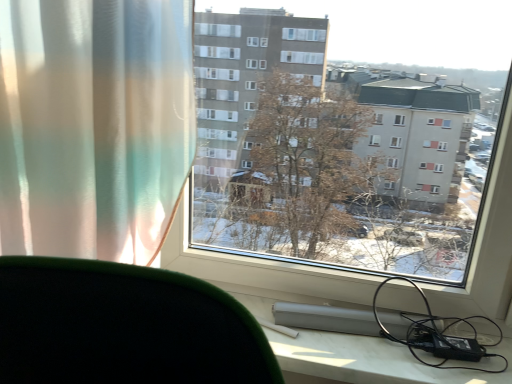
Locate an element on the screen. This screenshot has height=384, width=512. translucent fabric curtain at left is located at coordinates (94, 126).

Locate an element on the screen. Image resolution: width=512 pixels, height=384 pixels. transparent glass window at center is located at coordinates (353, 161).

Does transparent glass window at center have a lesser width compared to black rubber cable at lower right?

No, transparent glass window at center is not thinner than black rubber cable at lower right.

Can you confirm if transparent glass window at center is shorter than black rubber cable at lower right?

No.

In the scene shown: From a real-world perspective, is transparent glass window at center positioned above or below black rubber cable at lower right?

From a real-world perspective, transparent glass window at center is physically above black rubber cable at lower right.

The width and height of the screenshot is (512, 384). What are the coordinates of `window on the left of black rubber cable at lower right` in the screenshot? It's located at (353, 161).

From the picture: Looking at their sizes, would you say transparent glass window at center is wider or thinner than translucent fabric curtain at left?

Clearly, transparent glass window at center has less width compared to translucent fabric curtain at left.

I want to click on curtain lying in front of the transparent glass window at center, so click(94, 126).

How many degrees apart are the facing directions of transparent glass window at center and translucent fabric curtain at left?

The angular difference between transparent glass window at center and translucent fabric curtain at left is 0.593 degrees.

Is black rubber cable at lower right smaller than translucent fabric curtain at left?

Yes.

Is black rubber cable at lower right in contact with translucent fabric curtain at left?

black rubber cable at lower right and translucent fabric curtain at left are clearly separated.

Is black rubber cable at lower right wider or thinner than translucent fabric curtain at left?

Clearly, black rubber cable at lower right has less width compared to translucent fabric curtain at left.

Between black rubber cable at lower right and translucent fabric curtain at left, which one has more height?

Standing taller between the two is translucent fabric curtain at left.

From the image's perspective, is translucent fabric curtain at left positioned above or below black rubber cable at lower right?

translucent fabric curtain at left is above black rubber cable at lower right.

Is translucent fabric curtain at left far away from black rubber cable at lower right?

translucent fabric curtain at left is near black rubber cable at lower right, not far away.

Can you confirm if translucent fabric curtain at left is bigger than black rubber cable at lower right?

Yes.

Find the location of a particular element. The height and width of the screenshot is (384, 512). cable located behind the translucent fabric curtain at left is located at coordinates (439, 335).

Who is more distant, black rubber cable at lower right or transparent glass window at center?

Positioned behind is black rubber cable at lower right.

Is black rubber cable at lower right aimed at transparent glass window at center?

Yes, black rubber cable at lower right faces towards transparent glass window at center.

Considering the points (466, 321) and (343, 273), which point is in front, point (466, 321) or point (343, 273)?

Point (466, 321)

Is transparent glass window at center inside black rubber cable at lower right?

That's incorrect, transparent glass window at center is not inside black rubber cable at lower right.

Looking at this image, considering the relative sizes of translucent fabric curtain at left and transparent glass window at center in the image provided, is translucent fabric curtain at left shorter than transparent glass window at center?

Correct, translucent fabric curtain at left is not as tall as transparent glass window at center.

From a real-world perspective, is translucent fabric curtain at left physically located above or below transparent glass window at center?

From a real-world perspective, translucent fabric curtain at left is physically below transparent glass window at center.

From the image's perspective, is translucent fabric curtain at left above transparent glass window at center?

Incorrect, from the image's perspective, translucent fabric curtain at left is lower than transparent glass window at center.

The width and height of the screenshot is (512, 384). I want to click on window above the black rubber cable at lower right (from the image's perspective), so click(x=353, y=161).

Locate an element on the screen. window that appears above the translucent fabric curtain at left (from a real-world perspective) is located at coordinates (353, 161).

Consider the image. From the image, which object appears to be nearer to black rubber cable at lower right, transparent glass window at center or translucent fabric curtain at left?

transparent glass window at center is positioned closer to the anchor black rubber cable at lower right.

Looking at this image, estimate the real-world distances between objects in this image. Which object is further from transparent glass window at center, translucent fabric curtain at left or black rubber cable at lower right?

translucent fabric curtain at left.

Which object lies nearer to the anchor point black rubber cable at lower right, translucent fabric curtain at left or transparent glass window at center?

transparent glass window at center.

From the image, which object appears to be nearer to transparent glass window at center, black rubber cable at lower right or translucent fabric curtain at left?

The object closer to transparent glass window at center is black rubber cable at lower right.

From the image, which object appears to be nearer to translucent fabric curtain at left, black rubber cable at lower right or transparent glass window at center?

transparent glass window at center lies closer to translucent fabric curtain at left than the other object.

Which object lies further to the anchor point translucent fabric curtain at left, transparent glass window at center or black rubber cable at lower right?

black rubber cable at lower right.

What are the coordinates of `window between translucent fabric curtain at left and black rubber cable at lower right from left to right` in the screenshot? It's located at (353, 161).